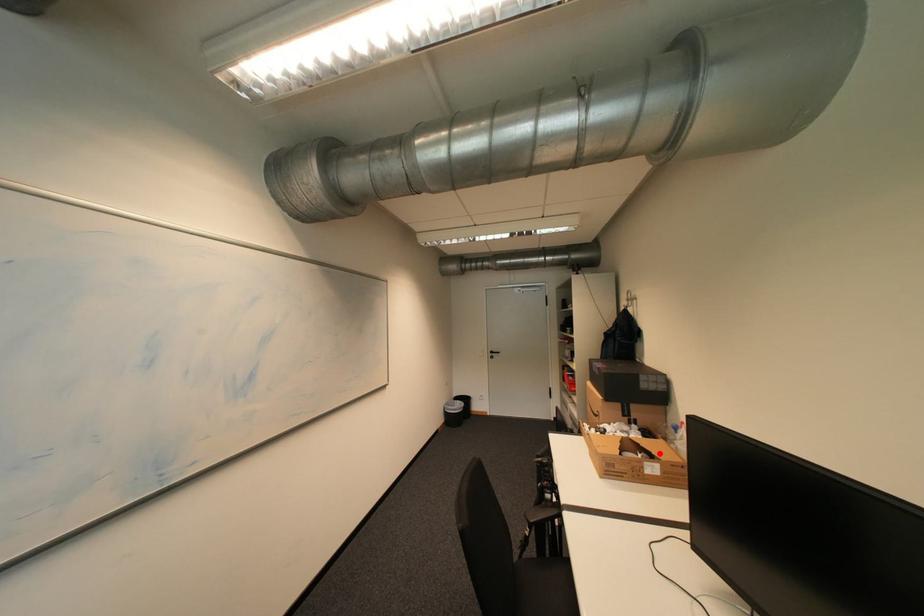
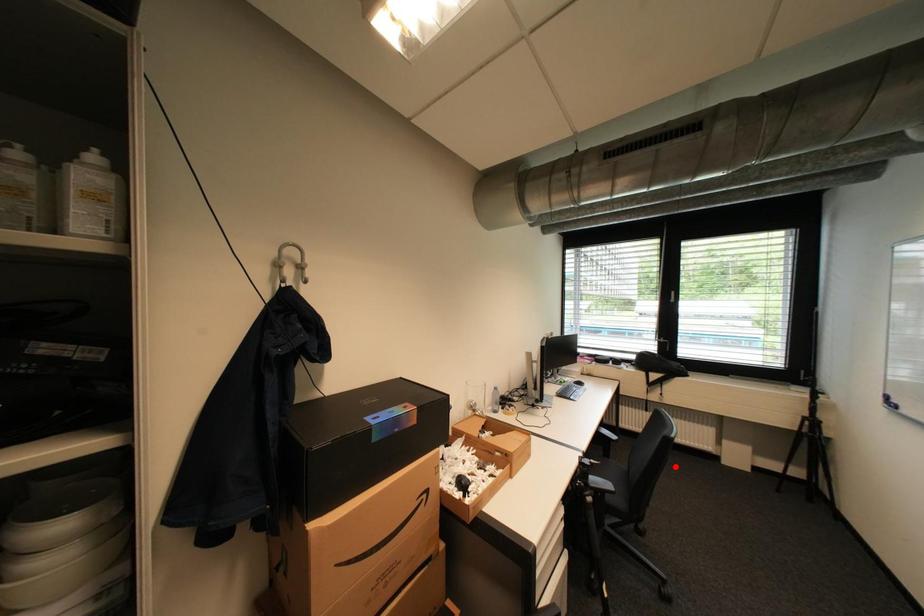
I am providing you with two images of the same scene from different viewpoints. A red point is marked on the first image and another point is marked on the second image. Is the marked point in image1 the same physical position as the marked point in image2?

No